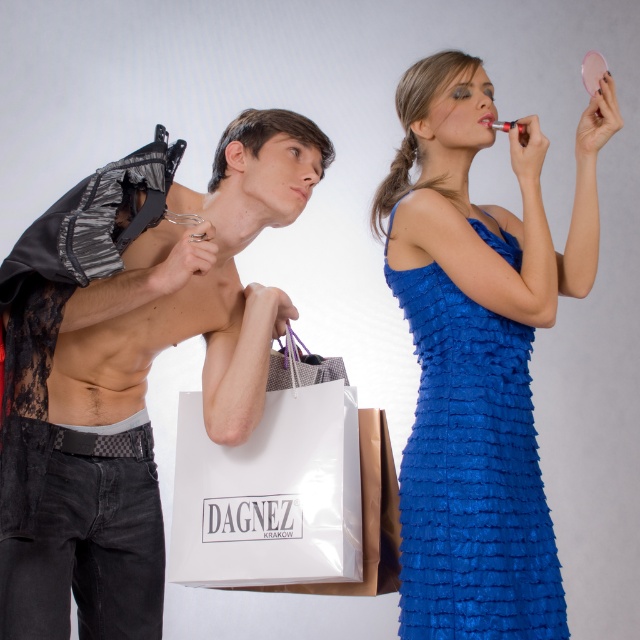
You are standing at the point marked by the coordinate point at point (42, 257). You want to hand a gift to the person on the left without the person on the right noticing. Which direction should you move to approach the person on the left while staying out of the person on the right field of view?

Move towards the left side of the person on the right to stay out of their field of view while approaching the person on the left.

You are a fashion designer observing the two outfits in the image. The lace fabric lingerie at left and the blue ruffled fabric dress at upper right are part of a new collection. Which outfit requires more fabric to produce based on their sizes?

The lace fabric lingerie at left requires more fabric to produce because it is bigger than the blue ruffled fabric dress at upper right.

In the scene shown: You are a fashion designer observing the scene. You notice the blue ruffled fabric dress at upper right and the white paper shopping bag at center. Which object takes up more space in the image?

The blue ruffled fabric dress at upper right is larger in size than the white paper shopping bag at center, so it takes up more space in the image.